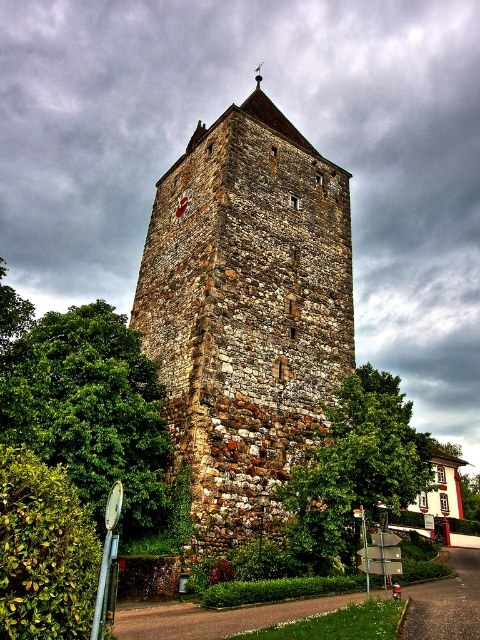
Is rustic stone tower at center shorter than green leafy tree at left?

No.

Does rustic stone tower at center appear over green leafy tree at left?

Indeed, rustic stone tower at center is positioned over green leafy tree at left.

Is point (286, 128) less distant than point (36, 387)?

No, (286, 128) is behind (36, 387).

This screenshot has height=640, width=480. In order to click on rustic stone tower at center in this screenshot , I will do `click(245, 308)`.

Is point (49, 316) behind point (325, 532)?

Yes, point (49, 316) is behind point (325, 532).

Can you confirm if green leafy tree at left is wider than green leafy tree at center?

In fact, green leafy tree at left might be narrower than green leafy tree at center.

Where is `green leafy tree at left`? This screenshot has width=480, height=640. green leafy tree at left is located at coordinates (90, 408).

Find the location of a particular element. Image resolution: width=480 pixels, height=640 pixels. rustic stone tower at center is located at coordinates (245, 308).

Locate an element on the screen. rustic stone tower at center is located at coordinates (245, 308).